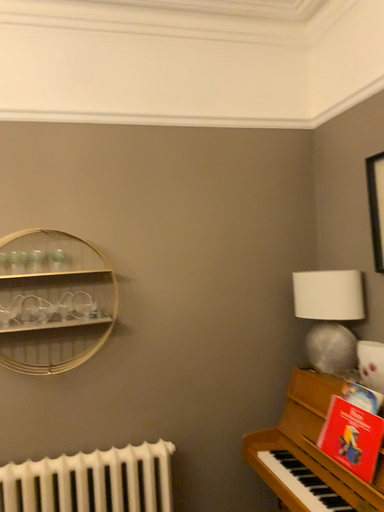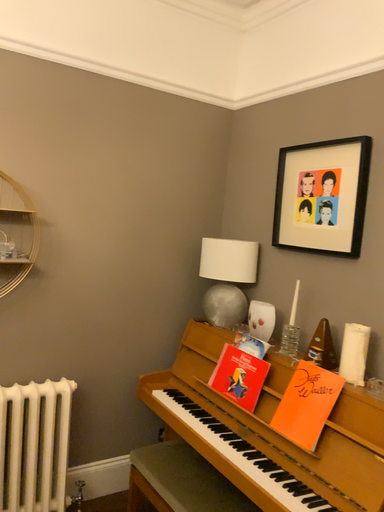
Question: How did the camera likely rotate when shooting the video?

Choices:
 (A) rotated upward
 (B) rotated downward

Answer: (B)